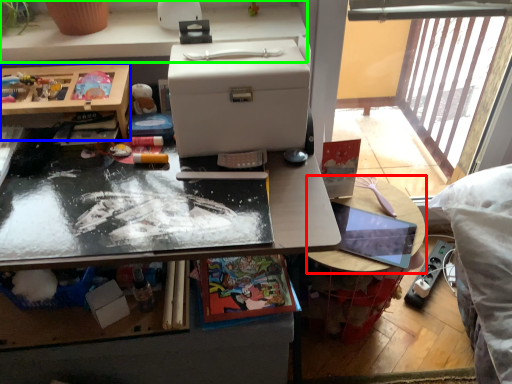
Question: Which is farther away from table (highlighted by a red box)? desk (highlighted by a blue box) or desk (highlighted by a green box)?

Choices:
 (A) desk
 (B) desk

Answer: (A)